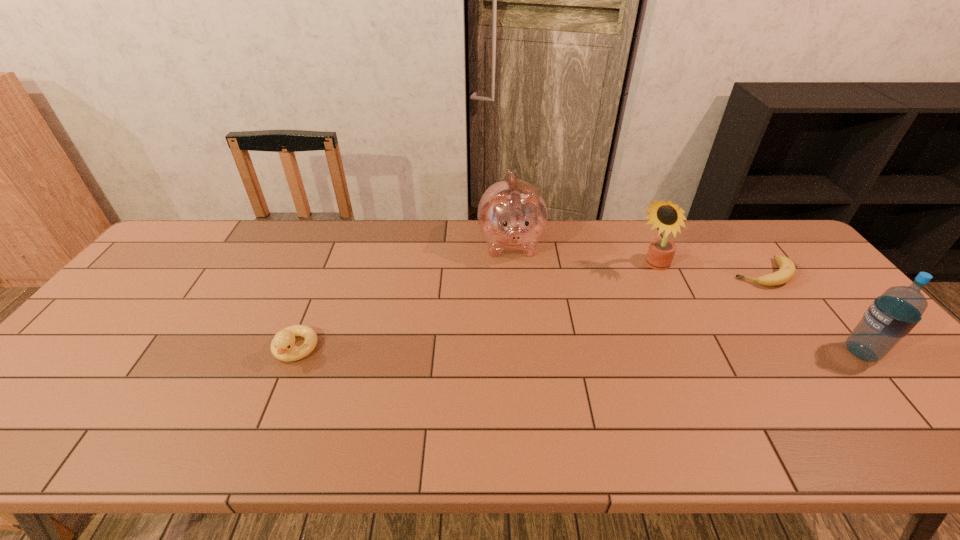
I want to click on water bottle situated at the right edge, so click(x=891, y=316).

Where is `banana at the right edge`? The image size is (960, 540). banana at the right edge is located at coordinates (786, 272).

This screenshot has height=540, width=960. I want to click on object located at the far right corner, so pyautogui.click(x=786, y=272).

Where is `vacant space at the far edge of the desktop`? The width and height of the screenshot is (960, 540). vacant space at the far edge of the desktop is located at coordinates (336, 257).

You are a GUI agent. You are given a task and a screenshot of the screen. Output one action in this format:
    pyautogui.click(x=<x>, y=<y>)
    Task: Click on the free space at the near edge of the desktop
    This screenshot has height=540, width=960.
    Given the screenshot: What is the action you would take?
    pyautogui.click(x=133, y=395)

The image size is (960, 540). I want to click on free space at the left edge, so click(187, 284).

Where is `vacant point at the right edge`? This screenshot has height=540, width=960. vacant point at the right edge is located at coordinates (785, 295).

This screenshot has height=540, width=960. I want to click on free space at the far right corner of the desktop, so click(x=758, y=235).

What are the coordinates of `free spot at the near right corner of the desktop` in the screenshot? It's located at (914, 389).

I want to click on vacant area that lies between the water bottle and the fourth tallest object, so click(x=578, y=351).